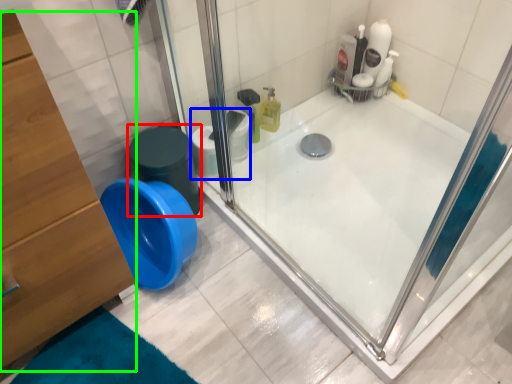
Question: Considering the real-world distances, which object is farthest from potty (highlighted by a red box)? toilet paper (highlighted by a blue box) or dresser (highlighted by a green box)?

Choices:
 (A) toilet paper
 (B) dresser

Answer: (B)